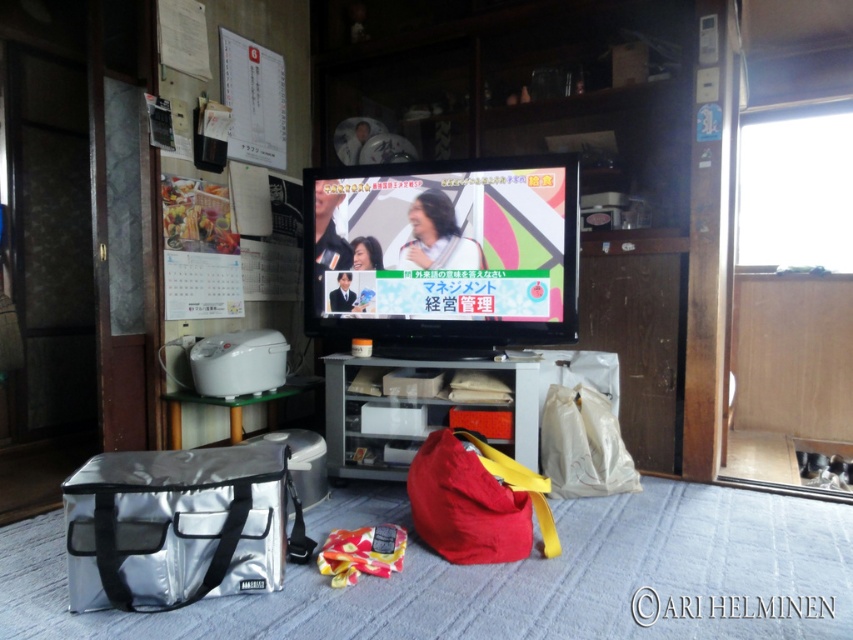
Question: Does silver/reflective insulated bag at lower left lie in front of white matte bag at lower right?

Choices:
 (A) no
 (B) yes

Answer: (B)

Question: Which point is closer to the camera?

Choices:
 (A) (548, 410)
 (B) (270, 588)

Answer: (B)

Question: Observing the image, what is the correct spatial positioning of matte plastic tv at center in reference to silver/reflective insulated bag at lower left?

Choices:
 (A) above
 (B) below

Answer: (A)

Question: Considering the real-world distances, which object is closest to the matte plastic tv at center?

Choices:
 (A) silver/reflective insulated bag at lower left
 (B) white matte bag at lower right
 (C) matte red bag at center

Answer: (B)

Question: Is matte plastic tv at center below white matte bag at lower right?

Choices:
 (A) yes
 (B) no

Answer: (B)

Question: Among these points, which one is nearest to the camera?

Choices:
 (A) (531, 301)
 (B) (419, 524)
 (C) (235, 499)
 (D) (579, 440)

Answer: (C)